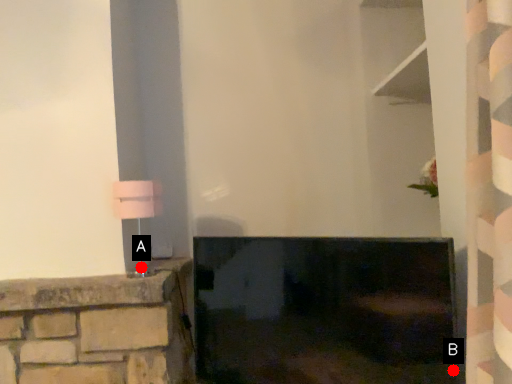
Question: Two points are circled on the image, labeled by A and B beside each circle. Which point appears closest to the camera in this image?

Choices:
 (A) A is closer
 (B) B is closer

Answer: (B)